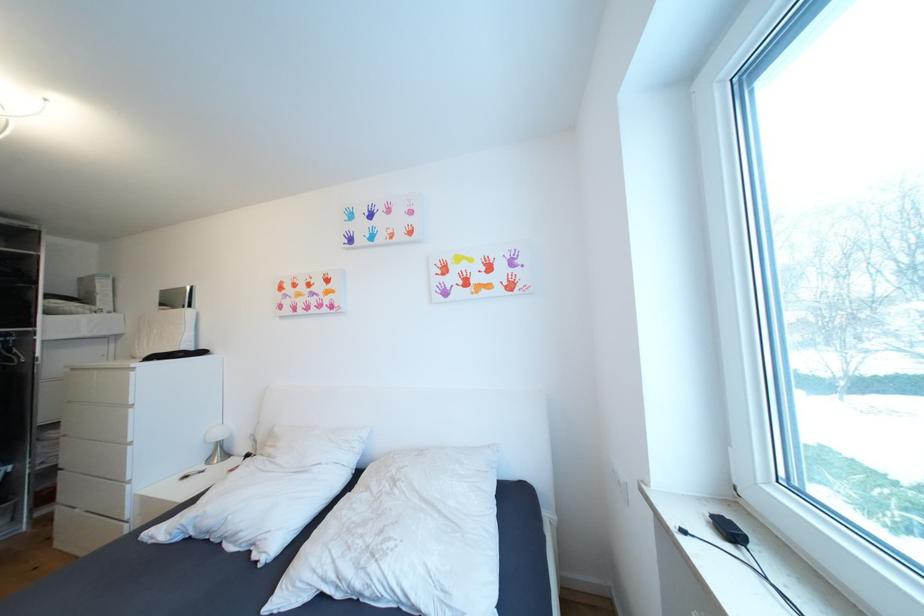
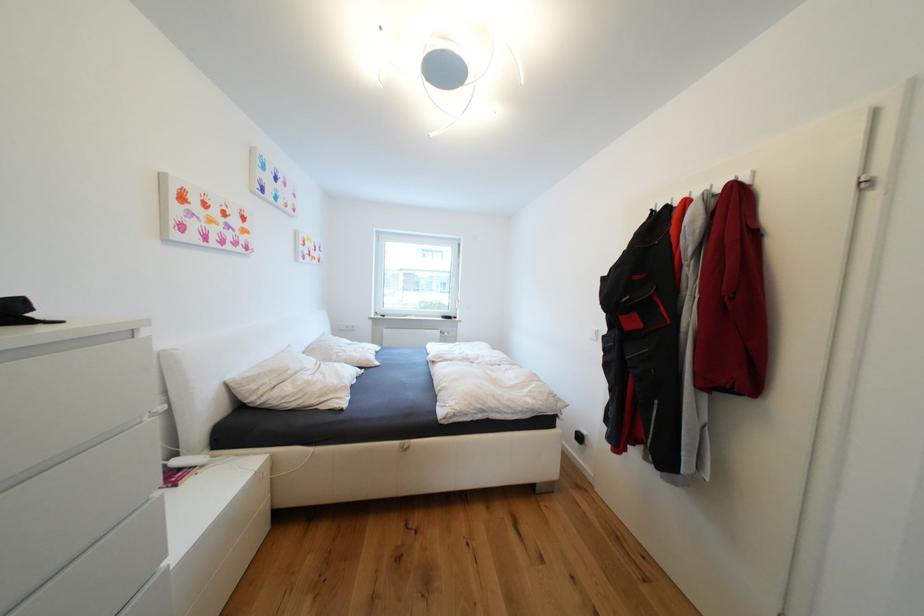
The point at (x=276, y=456) is marked in the first image. Where is the corresponding point in the second image?

(304, 374)